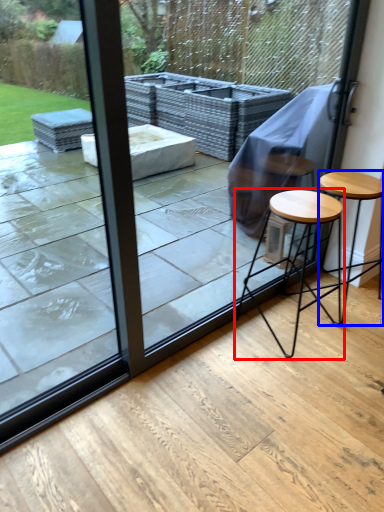
Question: Which object is further to the camera taking this photo, stool (highlighted by a red box) or stool (highlighted by a blue box)?

Choices:
 (A) stool
 (B) stool

Answer: (B)